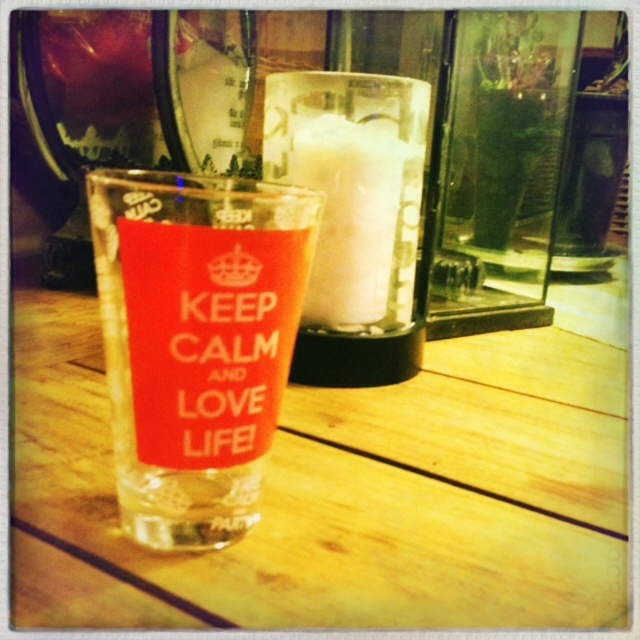
Is point (125, 493) behind point (349, 184)?

No.

Is transparent plastic cup at center below white frothy milk at center?

Yes.

Is point (260, 230) behind point (380, 208)?

That is False.

Find the location of a particular element. The image size is (640, 640). transparent plastic cup at center is located at coordinates (195, 340).

Can you confirm if transparent plastic cup at center is positioned to the right of matte orange sign at center?

Incorrect, transparent plastic cup at center is not on the right side of matte orange sign at center.

Can you confirm if transparent plastic cup at center is smaller than matte orange sign at center?

Actually, transparent plastic cup at center might be larger than matte orange sign at center.

What do you see at coordinates (195, 340) in the screenshot? I see `transparent plastic cup at center` at bounding box center [195, 340].

Identify the location of transparent plastic cup at center. (195, 340).

Which is below, white frothy milk at center or matte orange sign at center?

matte orange sign at center is below.

You are a GUI agent. You are given a task and a screenshot of the screen. Output one action in this format:
    pyautogui.click(x=<x>, y=<y>)
    Task: Click on the white frothy milk at center
    
    Given the screenshot: What is the action you would take?
    pyautogui.click(x=358, y=220)

This screenshot has height=640, width=640. Identify the location of white frothy milk at center. (358, 220).